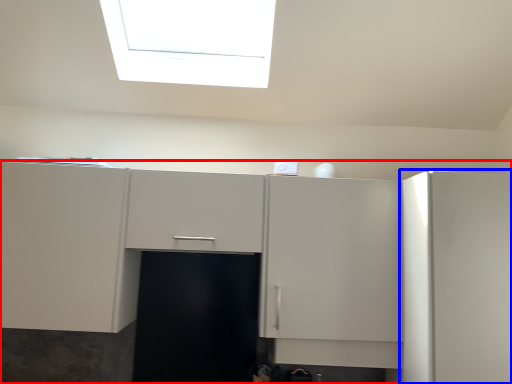
Question: Which of the following is the farthest to the observer, cabinetry (highlighted by a red box) or cabinetry (highlighted by a blue box)?

Choices:
 (A) cabinetry
 (B) cabinetry

Answer: (A)